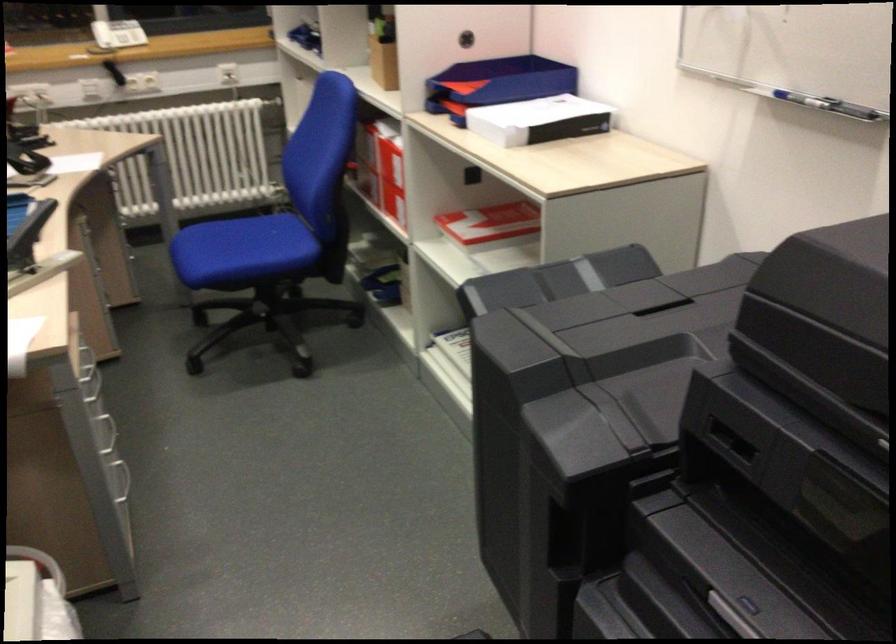
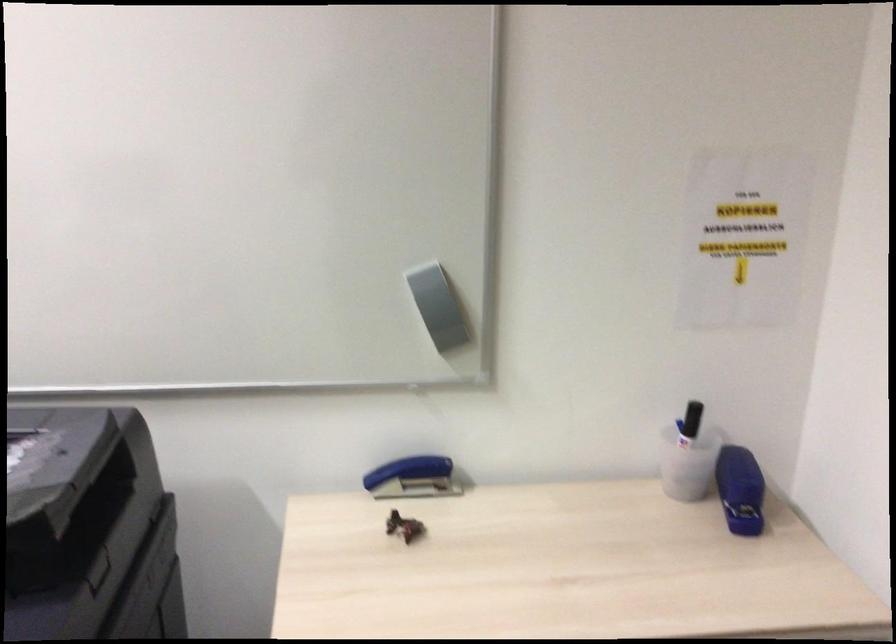
Question: The images are taken continuously from a first-person perspective. In which direction is your viewpoint rotating?

Choices:
 (A) Left
 (B) Right
 (C) Up
 (D) Down

Answer: (B)